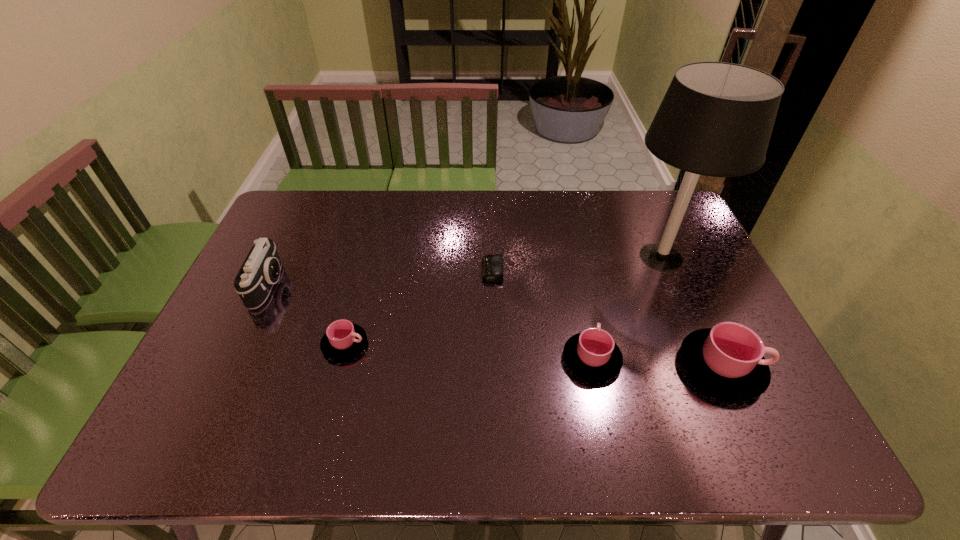
You are a GUI agent. You are given a task and a screenshot of the screen. Output one action in this format:
    pyautogui.click(x=<x>, y=<y>)
    Task: Click on the object located at the far edge
    
    Given the screenshot: What is the action you would take?
    pyautogui.click(x=716, y=119)

This screenshot has width=960, height=540. I want to click on object that is at the left edge, so click(x=260, y=271).

Locate an element on the screen. The height and width of the screenshot is (540, 960). cup that is at the right edge is located at coordinates (728, 359).

Find the location of a particular element. This screenshot has width=960, height=540. table lamp located in the right edge section of the desktop is located at coordinates (716, 119).

Identify the location of object that is at the far right corner. Image resolution: width=960 pixels, height=540 pixels. (716, 119).

You are a GUI agent. You are given a task and a screenshot of the screen. Output one action in this format:
    pyautogui.click(x=<x>, y=<y>)
    Task: Click on the object positioned at the near right corner
    This screenshot has height=540, width=960.
    Given the screenshot: What is the action you would take?
    pyautogui.click(x=728, y=359)

Image resolution: width=960 pixels, height=540 pixels. What are the coordinates of `vacant space at the far edge of the desktop` in the screenshot? It's located at coord(587,196).

Image resolution: width=960 pixels, height=540 pixels. What are the coordinates of `vacant area at the near edge` in the screenshot? It's located at (602, 395).

The image size is (960, 540). What are the coordinates of `free location at the far left corner of the desktop` in the screenshot? It's located at (303, 196).

You are a GUI agent. You are given a task and a screenshot of the screen. Output one action in this format:
    pyautogui.click(x=<x>, y=<y>)
    Task: Click on the free space at the near left corner
    This screenshot has width=960, height=540.
    Given the screenshot: What is the action you would take?
    pyautogui.click(x=250, y=382)